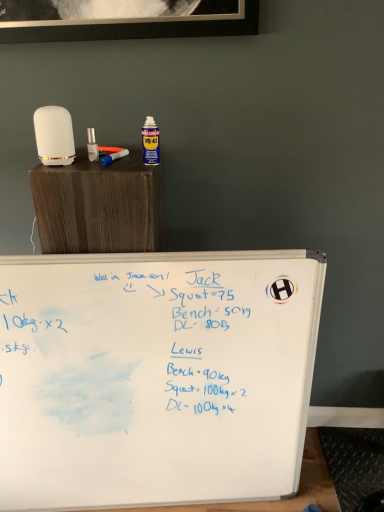
Question: Visually, is blue plastic paint brush at upper left positioned to the left or to the right of whiteboard at lower center?

Choices:
 (A) right
 (B) left

Answer: (B)

Question: Considering their positions, is blue plastic paint brush at upper left located in front of or behind whiteboard at lower center?

Choices:
 (A) behind
 (B) front

Answer: (B)

Question: From a real-world perspective, is blue plastic paint brush at upper left physically located above or below whiteboard at lower center?

Choices:
 (A) above
 (B) below

Answer: (A)

Question: Considering the positions of point (258, 506) and point (127, 151), is point (258, 506) closer or farther from the camera than point (127, 151)?

Choices:
 (A) closer
 (B) farther

Answer: (B)

Question: Is whiteboard at lower center bigger or smaller than blue plastic paint brush at upper left?

Choices:
 (A) big
 (B) small

Answer: (A)

Question: From the image's perspective, relative to blue plastic paint brush at upper left, is whiteboard at lower center above or below?

Choices:
 (A) above
 (B) below

Answer: (B)

Question: In the image, is whiteboard at lower center on the left side or the right side of blue plastic paint brush at upper left?

Choices:
 (A) left
 (B) right

Answer: (B)